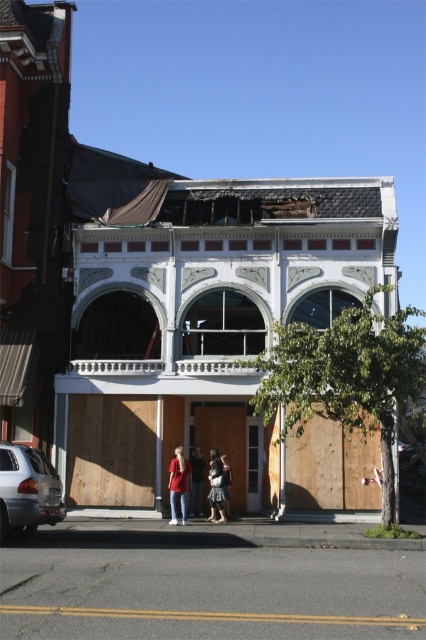
Question: Among these points, which one is farthest from the camera?

Choices:
 (A) (215, 481)
 (B) (43, 500)
 (C) (224, 480)

Answer: (C)

Question: Does silver metallic car at lower left have a lesser width compared to light brown leather jacket at center?

Choices:
 (A) yes
 (B) no

Answer: (B)

Question: Which object is positioned closest to the light brown leather jacket at center?

Choices:
 (A) silver metallic car at lower left
 (B) denim skirt at center

Answer: (B)

Question: Is silver metallic car at lower left below denim pants at lower center?

Choices:
 (A) yes
 (B) no

Answer: (B)

Question: Which of the following is the closest to the observer?

Choices:
 (A) denim pants at lower center
 (B) silver metallic car at lower left

Answer: (B)

Question: Does denim pants at lower center have a greater width compared to denim skirt at center?

Choices:
 (A) no
 (B) yes

Answer: (B)